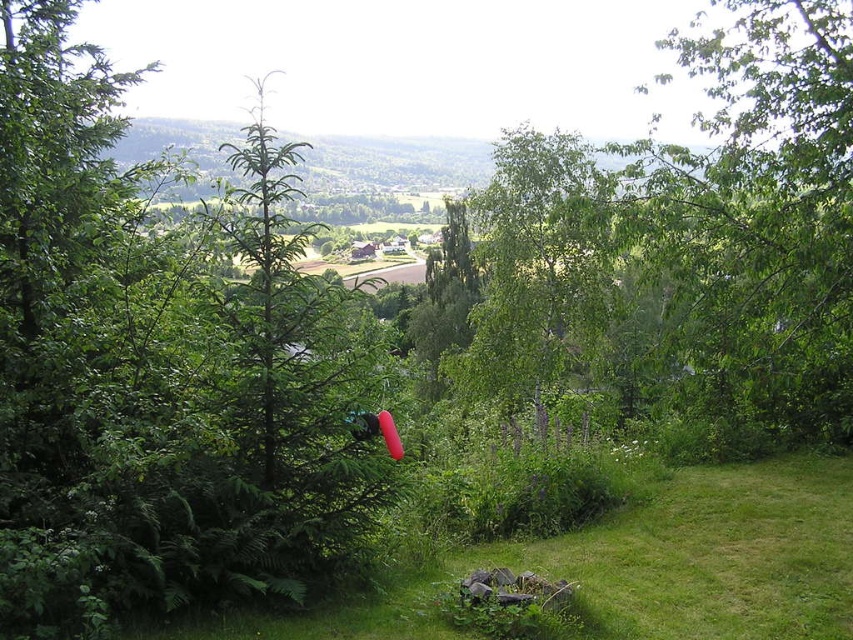
Question: Based on their relative distances, which object is nearer to the green leafy tree at left?

Choices:
 (A) green leafy tree at center
 (B) green grass at lower left

Answer: (A)

Question: Is green leafy tree at left bigger than green grass at lower left?

Choices:
 (A) yes
 (B) no

Answer: (A)

Question: Estimate the real-world distances between objects in this image. Which object is farther from the green leafy tree at center?

Choices:
 (A) green grass at lower left
 (B) green leafy tree at left

Answer: (A)

Question: Is green leafy tree at left smaller than green grass at lower left?

Choices:
 (A) no
 (B) yes

Answer: (A)

Question: Which point appears closest to the camera in this image?

Choices:
 (A) (579, 576)
 (B) (1, 336)
 (C) (640, 273)

Answer: (B)

Question: Is green leafy tree at center wider than green grass at lower left?

Choices:
 (A) yes
 (B) no

Answer: (A)